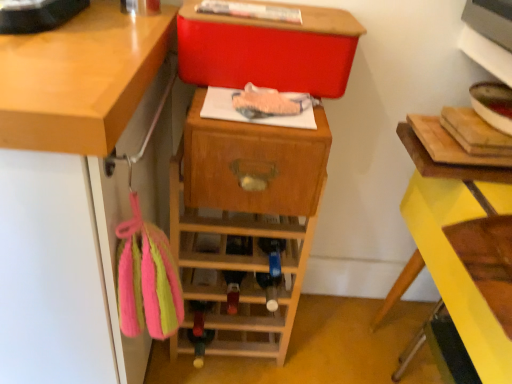
Question: Is wooden drawer at center next to matte red storage box at upper center and touching it?

Choices:
 (A) yes
 (B) no

Answer: (B)

Question: Is the position of wooden drawer at center less distant than that of matte red storage box at upper center?

Choices:
 (A) no
 (B) yes

Answer: (B)

Question: Is wooden drawer at center at the right side of matte red storage box at upper center?

Choices:
 (A) yes
 (B) no

Answer: (B)

Question: Is wooden drawer at center thinner than matte red storage box at upper center?

Choices:
 (A) no
 (B) yes

Answer: (B)

Question: From a real-world perspective, is wooden drawer at center physically above matte red storage box at upper center?

Choices:
 (A) yes
 (B) no

Answer: (B)

Question: From their relative heights in the image, would you say wooden wine rack at center is taller or shorter than wooden drawer at center?

Choices:
 (A) tall
 (B) short

Answer: (A)

Question: In terms of width, does wooden wine rack at center look wider or thinner when compared to wooden drawer at center?

Choices:
 (A) thin
 (B) wide

Answer: (B)

Question: Considering the relative positions of wooden wine rack at center and wooden drawer at center in the image provided, is wooden wine rack at center to the left or to the right of wooden drawer at center?

Choices:
 (A) left
 (B) right

Answer: (A)

Question: Considering the positions of point (291, 311) and point (258, 165), is point (291, 311) closer or farther from the camera than point (258, 165)?

Choices:
 (A) farther
 (B) closer

Answer: (A)

Question: From a real-world perspective, relative to wooden drawer at center, is yellow painted wood at right vertically above or below?

Choices:
 (A) below
 (B) above

Answer: (A)

Question: Visually, is yellow painted wood at right positioned to the left or to the right of wooden drawer at center?

Choices:
 (A) right
 (B) left

Answer: (A)

Question: Is yellow painted wood at right bigger or smaller than wooden drawer at center?

Choices:
 (A) big
 (B) small

Answer: (A)

Question: Is point (401, 357) closer or farther from the camera than point (243, 168)?

Choices:
 (A) farther
 (B) closer

Answer: (A)

Question: Visually, is wooden wine rack at center positioned to the left or to the right of matte red storage box at upper center?

Choices:
 (A) left
 (B) right

Answer: (A)

Question: From the image's perspective, relative to matte red storage box at upper center, is wooden wine rack at center above or below?

Choices:
 (A) above
 (B) below

Answer: (B)